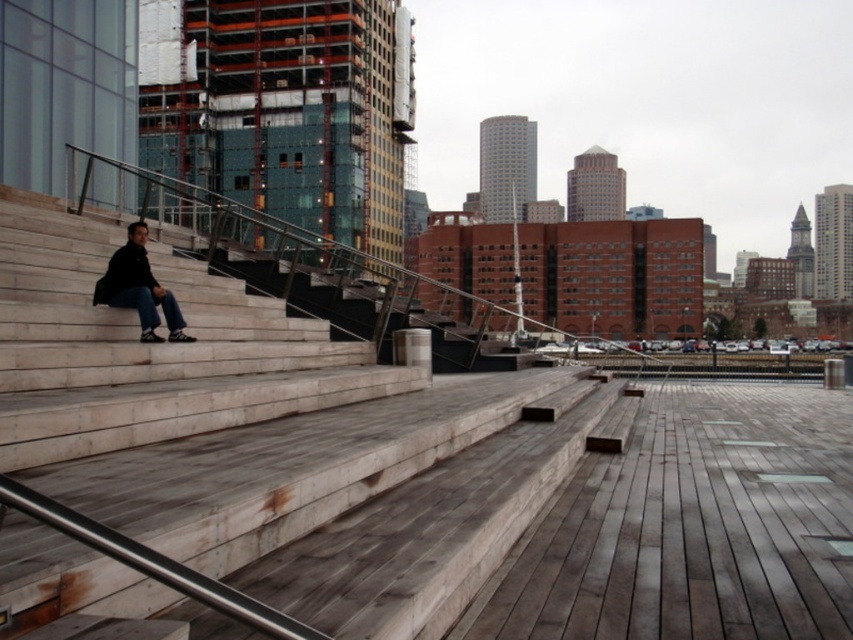
You are standing on the wooden stairs at left and want to place a small potted plant on the dark blue jeans at left. Will the plant be visible from above the jeans?

The wooden stairs at left is not as tall as dark blue jeans at left, so the plant placed on the dark blue jeans at left will not be visible from above since the jeans are taller.

You are standing in front of the wooden stairs at left and want to place a small potted plant between them and the dark blue jeans at left. Can you determine which object is closer to you to ensure proper placement?

The wooden stairs at left is closer to the viewer than the dark blue jeans at left, so you should place the potted plant between the wooden stairs at left and the dark blue jeans at left, positioning it closer to the stairs since they are nearer.